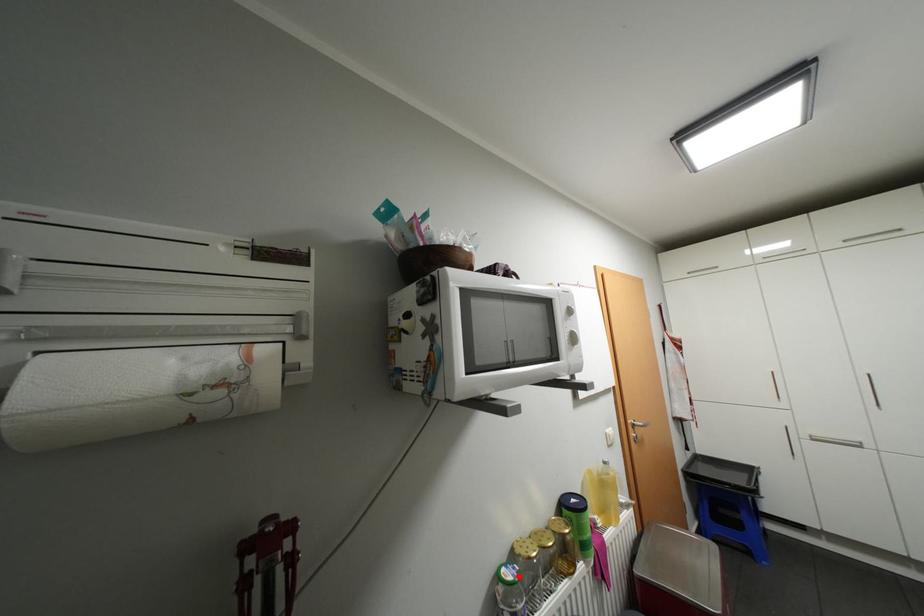
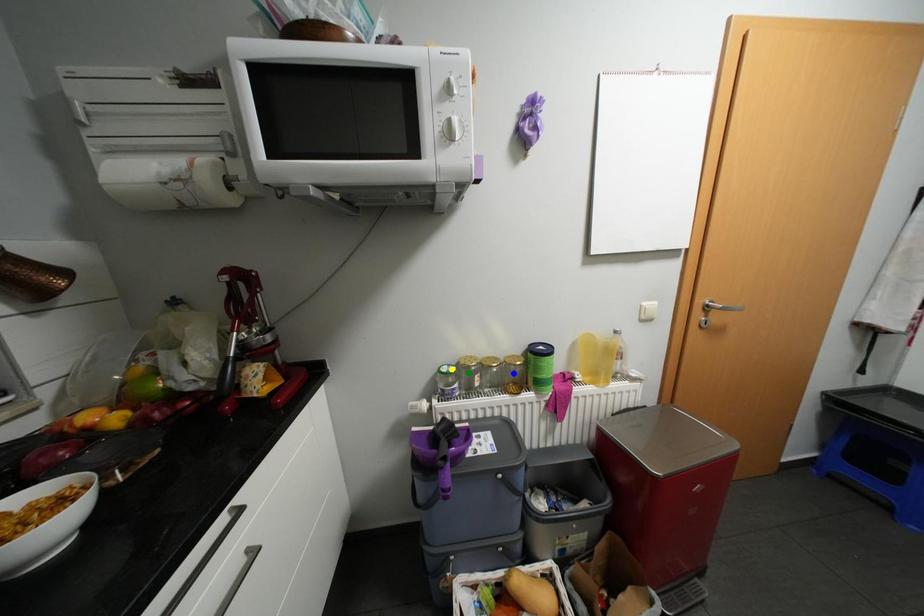
Question: I am providing you with two images of the same scene from different viewpoints. A red point is marked on the first image. You are given multiple points on the second image. Which mark in image 2 goes with the point in image 1?

Choices:
 (A) green point
 (B) yellow point
 (C) blue point

Answer: (B)